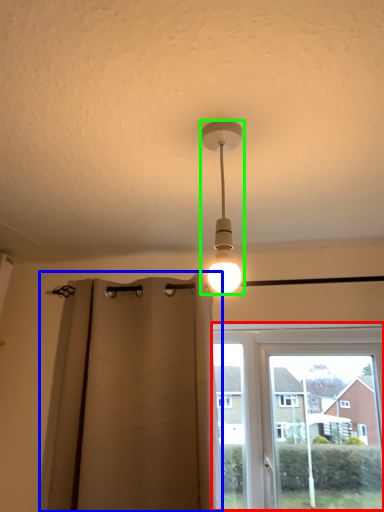
Question: Which object is the closest to the window (highlighted by a red box)? Choose among these: curtain (highlighted by a blue box) or lamp (highlighted by a green box).

Choices:
 (A) curtain
 (B) lamp

Answer: (A)